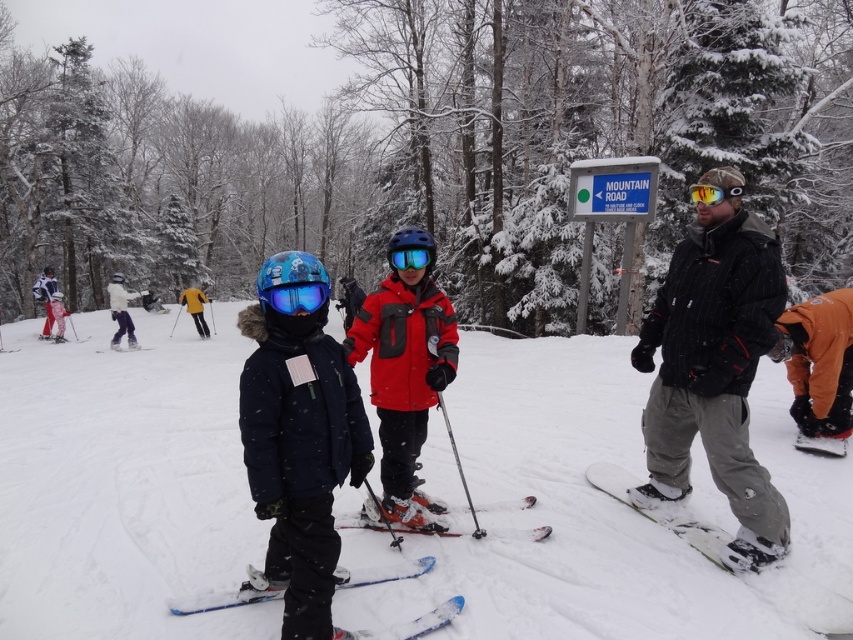
You are a photographer trying to capture a clear shot of the white matte snowboarder at upper left and the tinted plastic goggles at center. Since the snowboarder is larger, which object will appear closer to the camera in the photo?

The white matte snowboarder at upper left is larger in size than the tinted plastic goggles at center, so the snowboarder will appear closer to the camera in the photo because larger objects in a photo typically indicate proximity to the lens.

You are standing at the point labeled as point (714, 372) in the image. Looking around, you see three people in winter gear. Which person is directly in front of you?

The point labeled as point (714, 372) corresponds to the black textured jacket at right, so the person in the black textured jacket at right is directly in front of you.

Consider the image. You are planning to take a photo of the black textured jacket at right and the orange metallic ski at center. Based on their positions, which object should you focus on first to ensure both are in the frame?

The black textured jacket at right is located above the orange metallic ski at center, so you should focus on the orange metallic ski at center first to ensure both are in the frame.